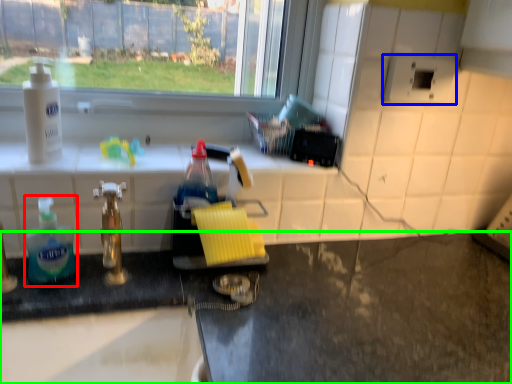
Question: Which object is the farthest from bottle (highlighted by a red box)? Choose among these: appliance (highlighted by a blue box) or counter (highlighted by a green box).

Choices:
 (A) appliance
 (B) counter

Answer: (A)